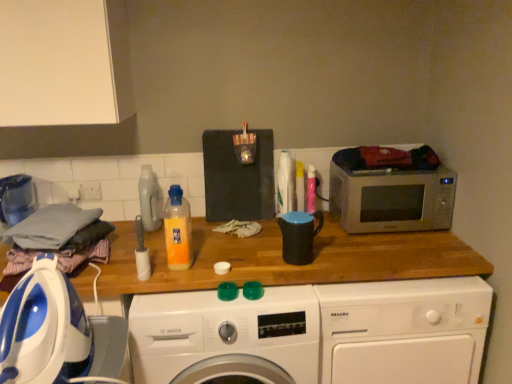
Question: From a real-world perspective, is white plastic roll at center, the 1th appliance when ordered from left to right, physically below matte plastic detergent at center, the 2th bottle viewed from the front?

Choices:
 (A) no
 (B) yes

Answer: (B)

Question: Does white plastic roll at center, which is the second appliance in right-to-left order, have a lesser width compared to matte plastic detergent at center, the 2th bottle viewed from the front?

Choices:
 (A) yes
 (B) no

Answer: (A)

Question: Is white plastic roll at center, the 1th appliance when ordered from left to right, located outside matte plastic detergent at center, which ranks as the first bottle in back-to-front order?

Choices:
 (A) no
 (B) yes

Answer: (B)

Question: Does white plastic roll at center, which is the 1th appliance in front-to-back order, lie in front of matte plastic detergent at center, the 2th bottle viewed from the front?

Choices:
 (A) yes
 (B) no

Answer: (A)

Question: Is white plastic roll at center, which is the second appliance in right-to-left order, far away from matte plastic detergent at center, placed as the second bottle when sorted from right to left?

Choices:
 (A) yes
 (B) no

Answer: (B)

Question: From the image's perspective, is matte plastic detergent at center, which ranks as the first bottle in back-to-front order, above or below blue/white plastic iron at left, which is the first washing machine from left to right?

Choices:
 (A) above
 (B) below

Answer: (A)

Question: Considering the positions of matte plastic detergent at center, the 2th bottle viewed from the front, and blue/white plastic iron at left, which is the first washing machine from left to right, in the image, is matte plastic detergent at center, the 2th bottle viewed from the front, wider or thinner than blue/white plastic iron at left, which is the first washing machine from left to right,?

Choices:
 (A) wide
 (B) thin

Answer: (B)

Question: Is matte plastic detergent at center, placed as the second bottle when sorted from right to left, inside the boundaries of blue/white plastic iron at left, which is the first washing machine from left to right, or outside?

Choices:
 (A) outside
 (B) inside

Answer: (A)

Question: Is point (159, 206) positioned closer to the camera than point (41, 342)?

Choices:
 (A) closer
 (B) farther

Answer: (B)

Question: Visually, is white plastic washing machine at center, the second washing machine from the left, positioned to the left or to the right of black matte mug at center, which appears as the second appliance when viewed from the front?

Choices:
 (A) right
 (B) left

Answer: (B)

Question: Do you think white plastic washing machine at center, the second washing machine from the left, is within black matte mug at center, which is counted as the 2th appliance, starting from the left, or outside of it?

Choices:
 (A) inside
 (B) outside

Answer: (B)

Question: From the image's perspective, is white plastic washing machine at center, acting as the 2th washing machine starting from the right, positioned above or below black matte mug at center, which is counted as the 2th appliance, starting from the left?

Choices:
 (A) below
 (B) above

Answer: (A)

Question: Does point (193, 314) appear closer or farther from the camera than point (276, 218)?

Choices:
 (A) farther
 (B) closer

Answer: (B)

Question: From the image's perspective, is translucent orange liquid at center, the 1th bottle from the front, positioned above or below black matte mug at center, which is counted as the 2th appliance, starting from the left?

Choices:
 (A) above
 (B) below

Answer: (A)

Question: Considering their positions, is translucent orange liquid at center, which is the second bottle from left to right, located in front of or behind black matte mug at center, which appears as the 1th appliance when viewed from the right?

Choices:
 (A) behind
 (B) front

Answer: (B)